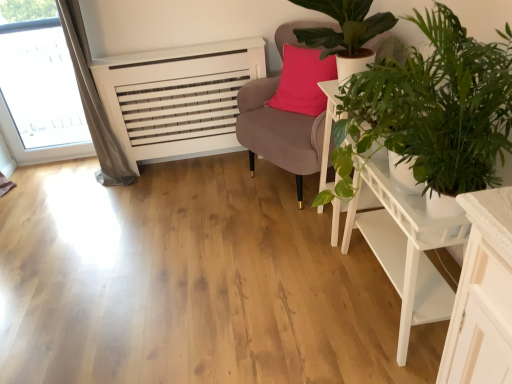
Where is `free spot to the left of white wooden side table at center right`? The image size is (512, 384). free spot to the left of white wooden side table at center right is located at coordinates (294, 231).